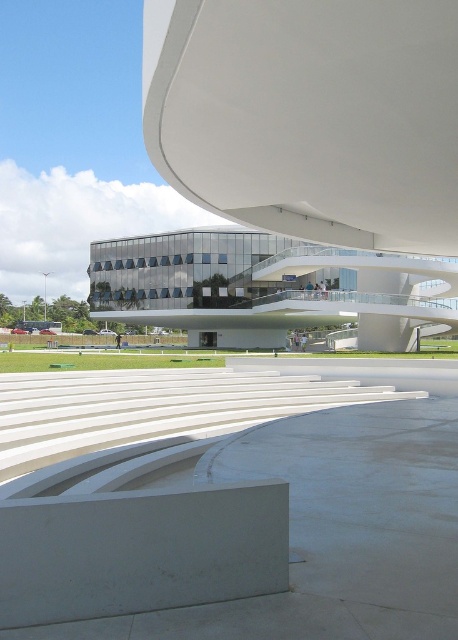
Question: Does white smooth amphitheater at center have a lesser width compared to transparent glass building at center?

Choices:
 (A) yes
 (B) no

Answer: (A)

Question: Does white smooth amphitheater at center have a greater width compared to transparent glass building at center?

Choices:
 (A) yes
 (B) no

Answer: (B)

Question: Which of the following is the closest to the observer?

Choices:
 (A) transparent glass building at center
 (B) white smooth amphitheater at center

Answer: (B)

Question: Is white smooth amphitheater at center below transparent glass building at center?

Choices:
 (A) yes
 (B) no

Answer: (A)